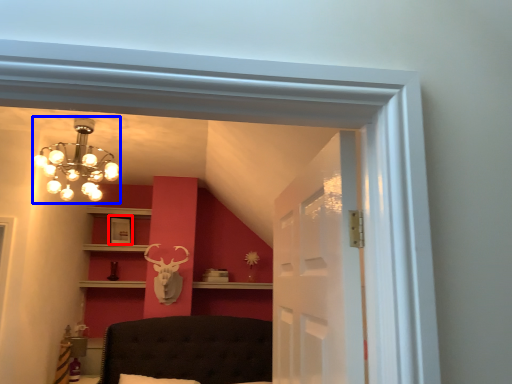
Question: Which of the following is the closest to the observer, picture frame (highlighted by a red box) or lamp (highlighted by a blue box)?

Choices:
 (A) picture frame
 (B) lamp

Answer: (B)